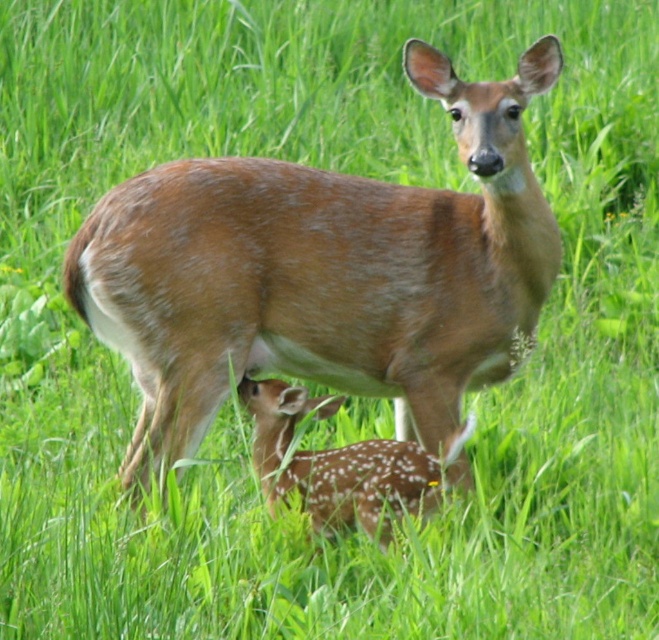
You are a wildlife photographer aiming to capture a closeup of both the brown fuzzy deer at center and the fawn fur fawn at center in the image. Given that your camera lens has a minimum focusing distance of 10 inches, can you take a clear photo of both subjects without moving the camera?

The brown fuzzy deer at center and the fawn fur fawn at center are 10.06 inches apart from each other. Since the minimum focusing distance is 10 inches, the camera can focus on both subjects as the distance between them is just slightly over the minimum requirement, allowing for a clear photo.

You are a wildlife photographer aiming to capture both the brown fuzzy deer at center and the fawn fur fawn at center in a single frame. Given that your camera has a fixed focal length, which deer should you position closer to the camera to ensure both fit in the frame?

Since the brown fuzzy deer at center is wider than the fawn fur fawn at center, you should position the brown fuzzy deer at center closer to the camera. This will help ensure both fit within the frame as the wider deer needs more space.